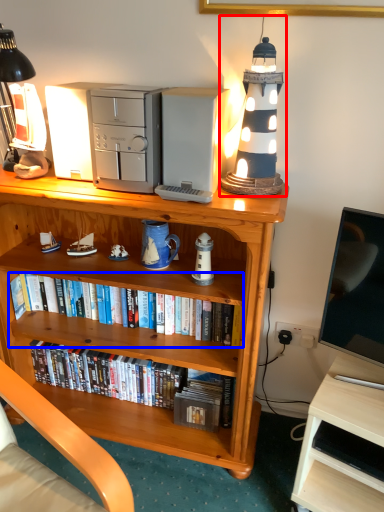
Question: Which object appears closest to the camera in this image, table lamp (highlighted by a red box) or book (highlighted by a blue box)?

Choices:
 (A) table lamp
 (B) book

Answer: (A)